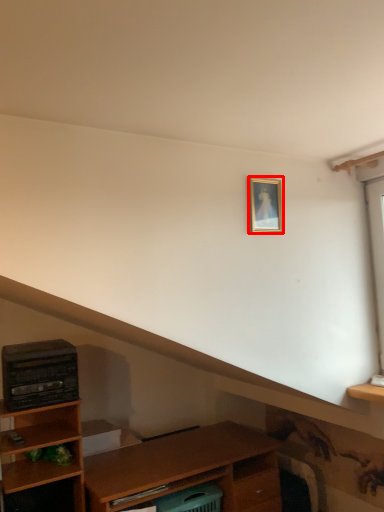
Question: From the image's perspective, where is picture frame (annotated by the red box) located relative to appliance?

Choices:
 (A) above
 (B) below

Answer: (A)